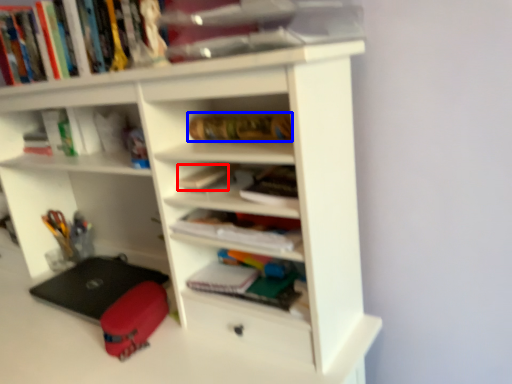
Question: Which of the following is the closest to the observer, book (highlighted by a red box) or book (highlighted by a blue box)?

Choices:
 (A) book
 (B) book

Answer: (B)